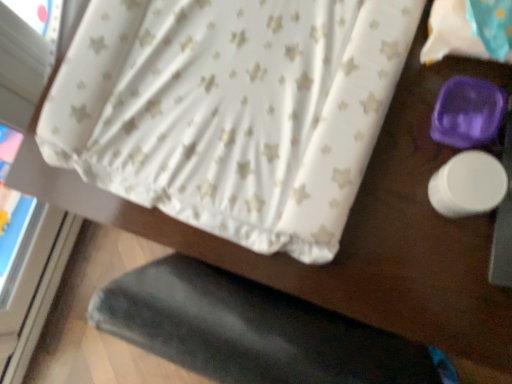
You are a GUI agent. You are given a task and a screenshot of the screen. Output one action in this format:
    pyautogui.click(x=<x>, y=<y>)
    Task: Click on the vacant point to the left of white star-patterned fabric at upper right
    Image resolution: width=512 pixels, height=384 pixels.
    Given the screenshot: What is the action you would take?
    pyautogui.click(x=379, y=91)